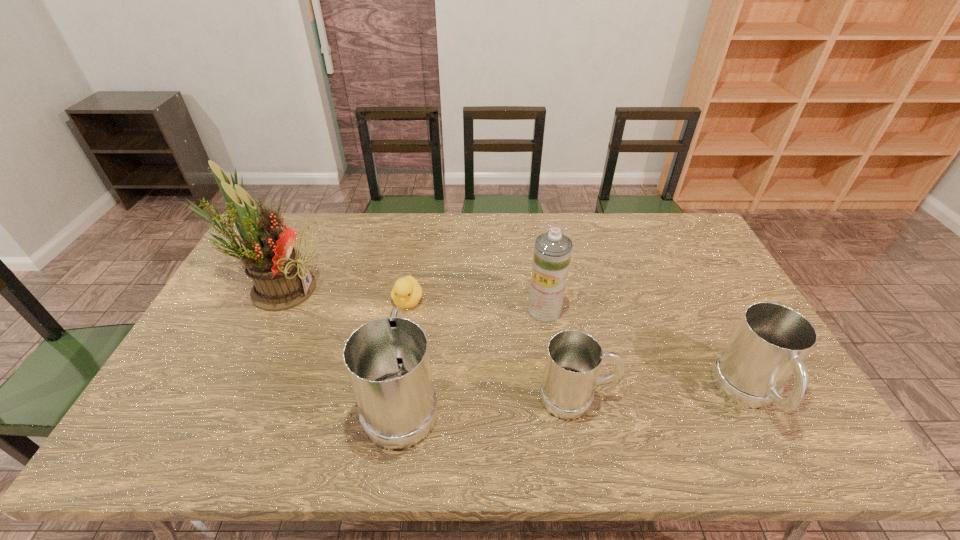
Locate an element on the screen. This screenshot has width=960, height=540. vacant space that satisfies the following two spatial constraints: 1. on the front-facing side of the shortest object; 2. on the right side of the aerosol can is located at coordinates (406, 310).